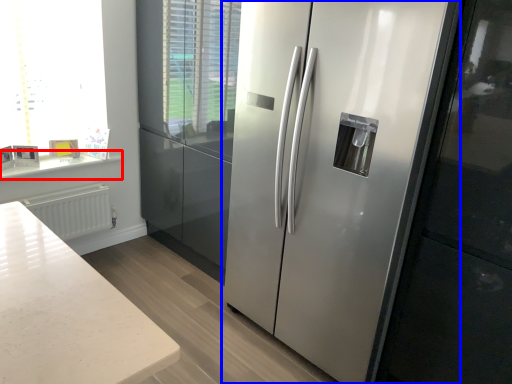
Question: Which of the following is the closest to the observer, counter top (highlighted by a red box) or refrigerator (highlighted by a blue box)?

Choices:
 (A) counter top
 (B) refrigerator

Answer: (B)